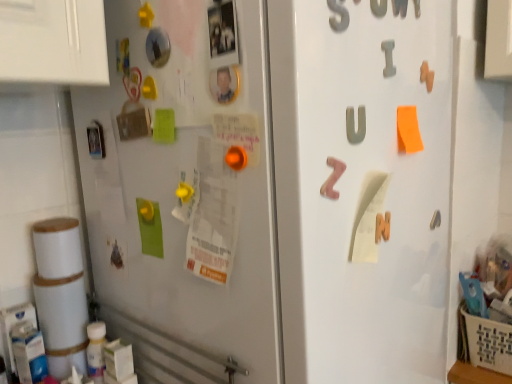
Question: Does metallic gray letter at upper center, positioned as the 2th number in left-to-right order, come behind pink foam letter z at center, the third alphabet when ordered from top to bottom?

Choices:
 (A) no
 (B) yes

Answer: (B)

Question: Does metallic gray letter at upper center, the first number in the right-to-left sequence, appear on the left side of pink foam letter z at center, the third alphabet when ordered from top to bottom?

Choices:
 (A) no
 (B) yes

Answer: (A)

Question: Can you confirm if metallic gray letter at upper center, the first number in the right-to-left sequence, is smaller than pink foam letter z at center, the third alphabet when ordered from top to bottom?

Choices:
 (A) yes
 (B) no

Answer: (A)

Question: Considering the relative positions of metallic gray letter at upper center, the first number from the back, and pink foam letter z at center, the third alphabet when ordered from top to bottom, in the image provided, is metallic gray letter at upper center, the first number from the back, to the right of pink foam letter z at center, the third alphabet when ordered from top to bottom, from the viewer's perspective?

Choices:
 (A) yes
 (B) no

Answer: (A)

Question: From a real-world perspective, is metallic gray letter at upper center, which is the second number from front to back, beneath pink foam letter z at center, which is the third alphabet in back-to-front order?

Choices:
 (A) yes
 (B) no

Answer: (B)

Question: Is point (384, 6) closer or farther from the camera than point (467, 316)?

Choices:
 (A) closer
 (B) farther

Answer: (A)

Question: In terms of size, does metallic gray letter at upper center, which is the second number from front to back, appear bigger or smaller than beige woven basket at lower right?

Choices:
 (A) big
 (B) small

Answer: (B)

Question: Considering the positions of metallic gray letter at upper center, the first number from the back, and beige woven basket at lower right in the image, is metallic gray letter at upper center, the first number from the back, taller or shorter than beige woven basket at lower right?

Choices:
 (A) tall
 (B) short

Answer: (B)

Question: Is metallic gray letter at upper center, the first number in the right-to-left sequence, inside the boundaries of beige woven basket at lower right, or outside?

Choices:
 (A) outside
 (B) inside

Answer: (A)

Question: Would you say pink foam letter z at center, the first alphabet when ordered from bottom to top, is to the left or to the right of gray matte letter i at upper right, the first alphabet in the right-to-left sequence, in the picture?

Choices:
 (A) left
 (B) right

Answer: (A)

Question: In the image, is pink foam letter z at center, which is the third alphabet in back-to-front order, positioned in front of or behind gray matte letter i at upper right, arranged as the 1th alphabet when viewed from the top?

Choices:
 (A) front
 (B) behind

Answer: (A)

Question: From their relative heights in the image, would you say pink foam letter z at center, acting as the 1th alphabet starting from the left, is taller or shorter than gray matte letter i at upper right, acting as the third alphabet starting from the bottom?

Choices:
 (A) tall
 (B) short

Answer: (A)

Question: Do you think pink foam letter z at center, which is the third alphabet in back-to-front order, is within gray matte letter i at upper right, acting as the third alphabet starting from the bottom, or outside of it?

Choices:
 (A) outside
 (B) inside

Answer: (A)

Question: Considering the positions of point (338, 18) and point (334, 192), is point (338, 18) closer or farther from the camera than point (334, 192)?

Choices:
 (A) farther
 (B) closer

Answer: (B)

Question: Looking at their shapes, would you say metallic gray letter at upper right, acting as the second number starting from the back, is wider or thinner than pink foam letter z at center, the third alphabet when ordered from right to left?

Choices:
 (A) thin
 (B) wide

Answer: (A)